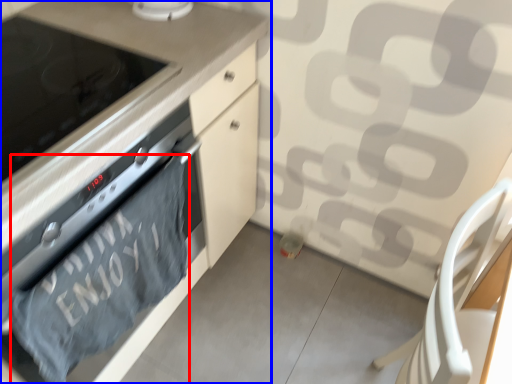
Question: Which of the following is the farthest to the observer, bath towel (highlighted by a red box) or cabinetry (highlighted by a blue box)?

Choices:
 (A) bath towel
 (B) cabinetry

Answer: (A)